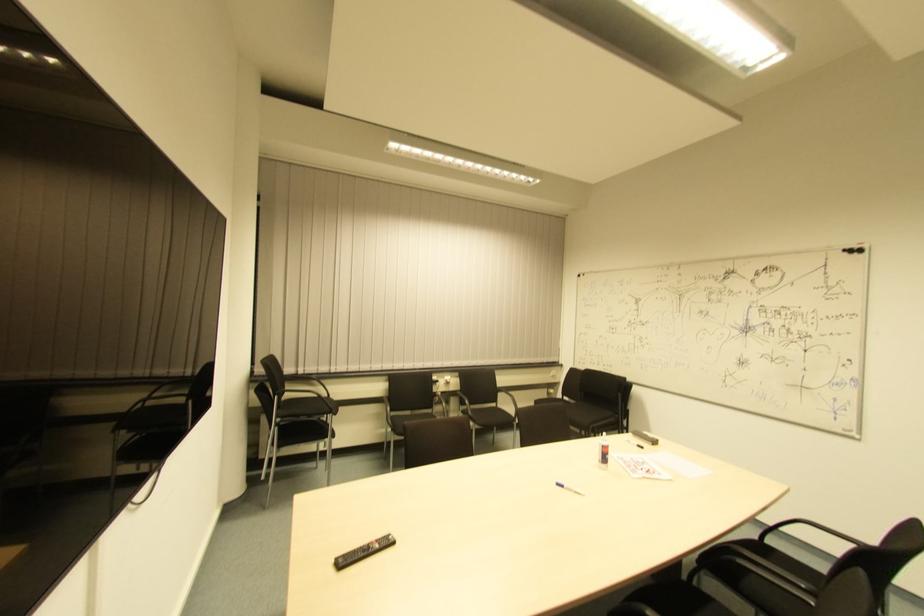
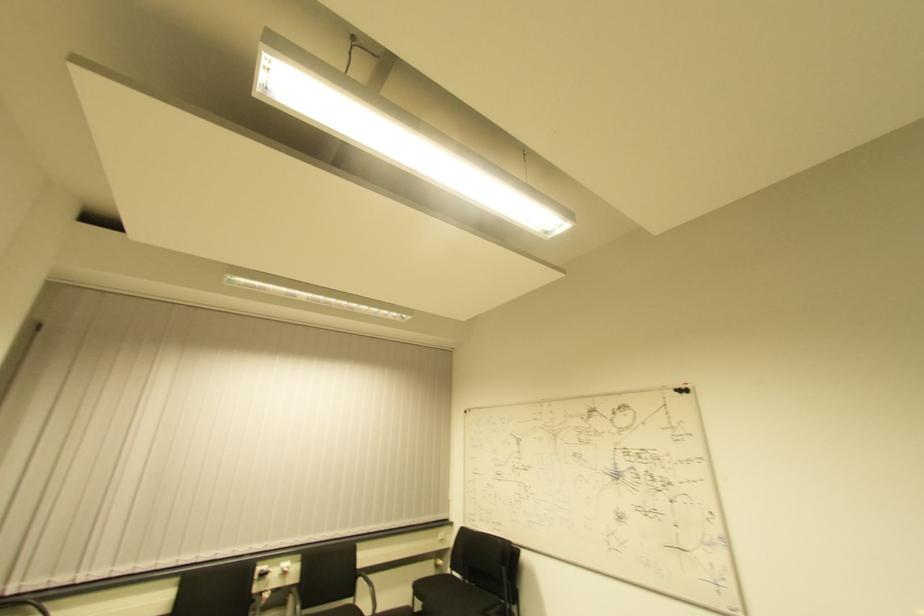
The point at (564, 400) is marked in the first image. Where is the corresponding point in the second image?

(454, 576)